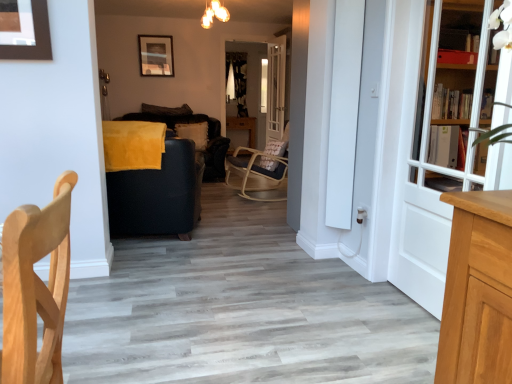
Question: Is warm glass chandelier at upper center positioned far away from beige textured pillow at center, the second pillow viewed from the top?

Choices:
 (A) no
 (B) yes

Answer: (B)

Question: Is warm glass chandelier at upper center behind beige textured pillow at center, the first pillow ordered from the bottom?

Choices:
 (A) no
 (B) yes

Answer: (A)

Question: Is warm glass chandelier at upper center facing towards beige textured pillow at center, the second pillow viewed from the top?

Choices:
 (A) yes
 (B) no

Answer: (B)

Question: Considering the relative sizes of warm glass chandelier at upper center and beige textured pillow at center, the first pillow ordered from the bottom, in the image provided, is warm glass chandelier at upper center shorter than beige textured pillow at center, the first pillow ordered from the bottom,?

Choices:
 (A) yes
 (B) no

Answer: (A)

Question: From a real-world perspective, is warm glass chandelier at upper center below beige textured pillow at center, the first pillow ordered from the bottom?

Choices:
 (A) yes
 (B) no

Answer: (B)

Question: From the image's perspective, is warm glass chandelier at upper center below beige textured pillow at center, the first pillow ordered from the bottom?

Choices:
 (A) yes
 (B) no

Answer: (B)

Question: Is matte black picture frame at upper center looking in the opposite direction of white wooden bookcase at right?

Choices:
 (A) no
 (B) yes

Answer: (A)

Question: Is matte black picture frame at upper center completely or partially outside of white wooden bookcase at right?

Choices:
 (A) yes
 (B) no

Answer: (A)

Question: Could you tell me if matte black picture frame at upper center is turned towards white wooden bookcase at right?

Choices:
 (A) no
 (B) yes

Answer: (B)

Question: Considering the relative positions of matte black picture frame at upper center and white wooden bookcase at right in the image provided, is matte black picture frame at upper center behind white wooden bookcase at right?

Choices:
 (A) yes
 (B) no

Answer: (A)

Question: Does matte black picture frame at upper center have a larger size compared to white wooden bookcase at right?

Choices:
 (A) yes
 (B) no

Answer: (B)

Question: Can you confirm if matte black picture frame at upper center is taller than white wooden bookcase at right?

Choices:
 (A) no
 (B) yes

Answer: (B)

Question: Can you confirm if white wooden bookcase at right is positioned to the left of suede-like brown pillow at center, which is counted as the 2th pillow, starting from the bottom?

Choices:
 (A) no
 (B) yes

Answer: (A)